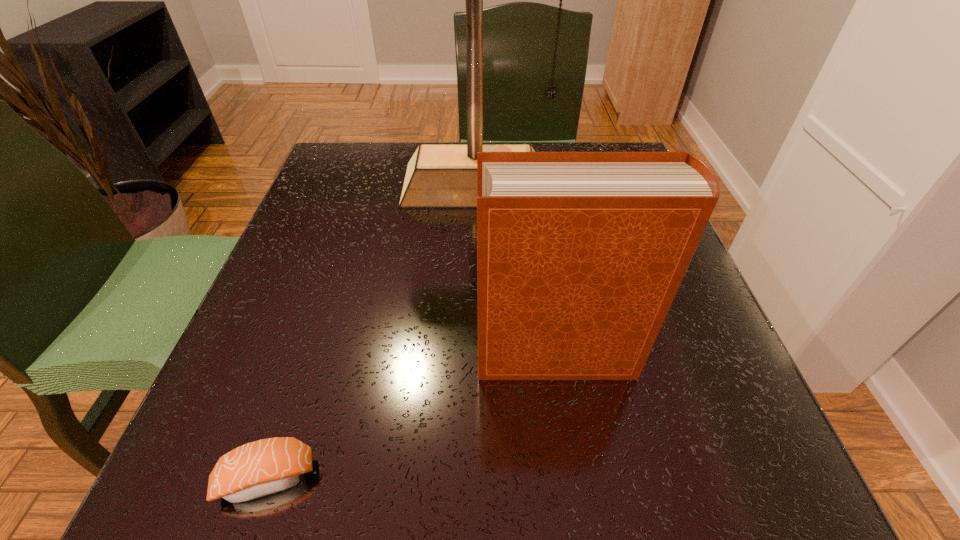
Image resolution: width=960 pixels, height=540 pixels. Identify the location of free location located 0.390m on the back of the leftmost object. (344, 247).

Find the location of `object situated at the far edge`. object situated at the far edge is located at coordinates (439, 176).

The width and height of the screenshot is (960, 540). Find the location of `object situated at the near edge`. object situated at the near edge is located at coordinates (263, 467).

Where is `object positioned at the left edge`? object positioned at the left edge is located at coordinates (263, 467).

This screenshot has height=540, width=960. Find the location of `object present at the right edge`. object present at the right edge is located at coordinates (580, 255).

Locate an element on the screen. object present at the near left corner is located at coordinates (263, 467).

The width and height of the screenshot is (960, 540). Identify the location of blank space at the near edge of the desktop. (573, 455).

Where is `free point at the left edge`? The width and height of the screenshot is (960, 540). free point at the left edge is located at coordinates (311, 417).

In the image, there is a desktop. Where is `free space at the far left corner`? Image resolution: width=960 pixels, height=540 pixels. free space at the far left corner is located at coordinates (350, 192).

In the image, there is a desktop. Identify the location of free region at the near left corner. This screenshot has width=960, height=540. (314, 454).